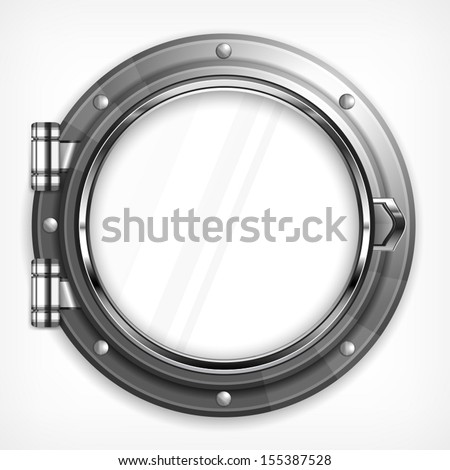
Locate an element on the screen. gray handle is located at coordinates (398, 222).